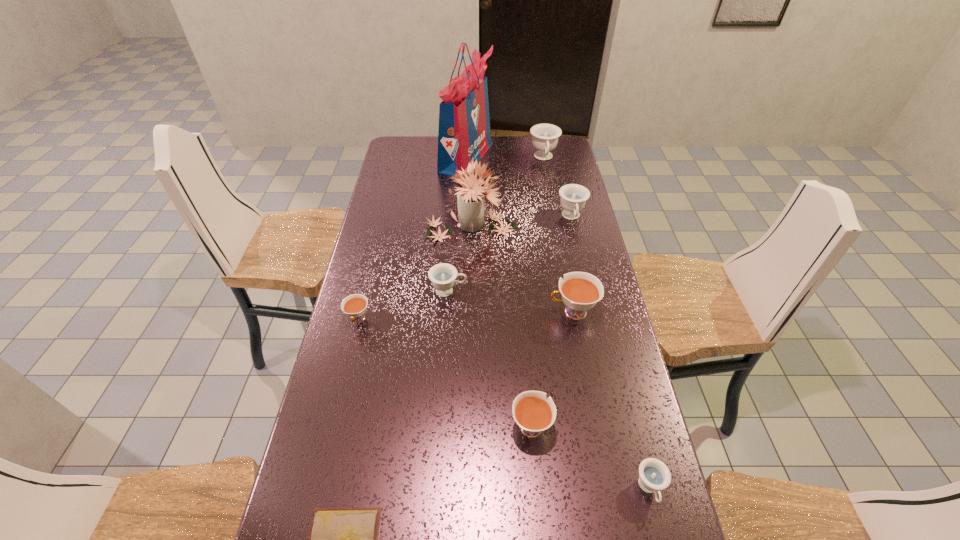
This screenshot has height=540, width=960. I want to click on red grocery bag, so click(x=464, y=135).

This screenshot has width=960, height=540. Identify the location of the tallest object. (464, 135).

The image size is (960, 540). I want to click on bouquet, so click(x=470, y=198).

Locate an element on the screen. The height and width of the screenshot is (540, 960). white bouquet is located at coordinates (470, 198).

Identify the location of the farthest blue teacup. (544, 136).

This screenshot has width=960, height=540. Find the location of `the biggest blue teacup`. the biggest blue teacup is located at coordinates (544, 136).

Locate an element on the screen. the rightmost white teacup is located at coordinates (580, 291).

The image size is (960, 540). I want to click on the sixth nearest teacup, so click(x=573, y=196).

Locate an element on the screen. Image resolution: width=960 pixels, height=540 pixels. the third nearest blue teacup is located at coordinates (573, 196).

At what (x,y) coordinates should I click in order to perform the action: click on the eighth farthest object. Please return your answer as a coordinate pair (x, y). Looking at the image, I should click on (534, 414).